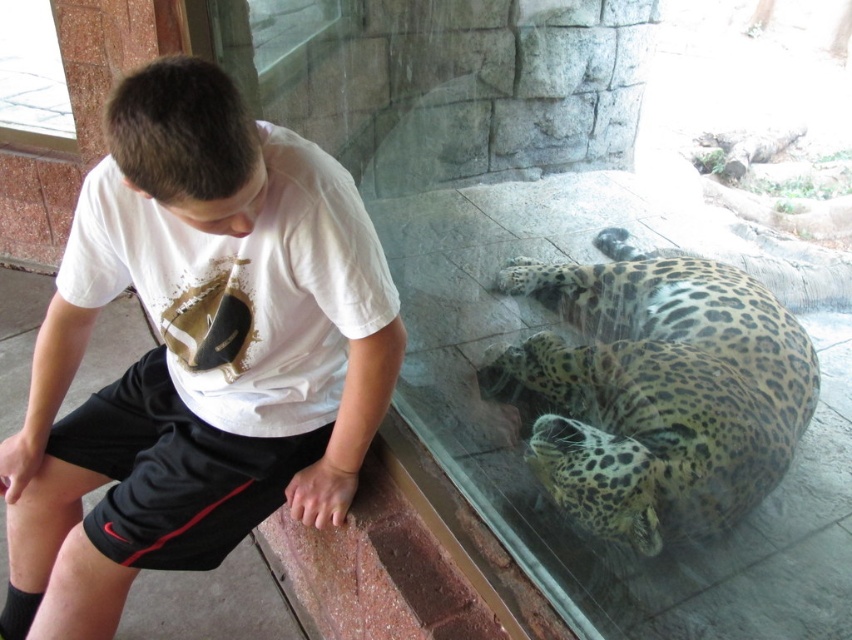
Which of these two, white cotton shirt at center or spotted fur leopard at lower right, stands shorter?

spotted fur leopard at lower right is shorter.

Does white cotton shirt at center have a lesser height compared to spotted fur leopard at lower right?

No.

Image resolution: width=852 pixels, height=640 pixels. What do you see at coordinates (196, 353) in the screenshot?
I see `white cotton shirt at center` at bounding box center [196, 353].

Where is `white cotton shirt at center`? Image resolution: width=852 pixels, height=640 pixels. white cotton shirt at center is located at coordinates (196, 353).